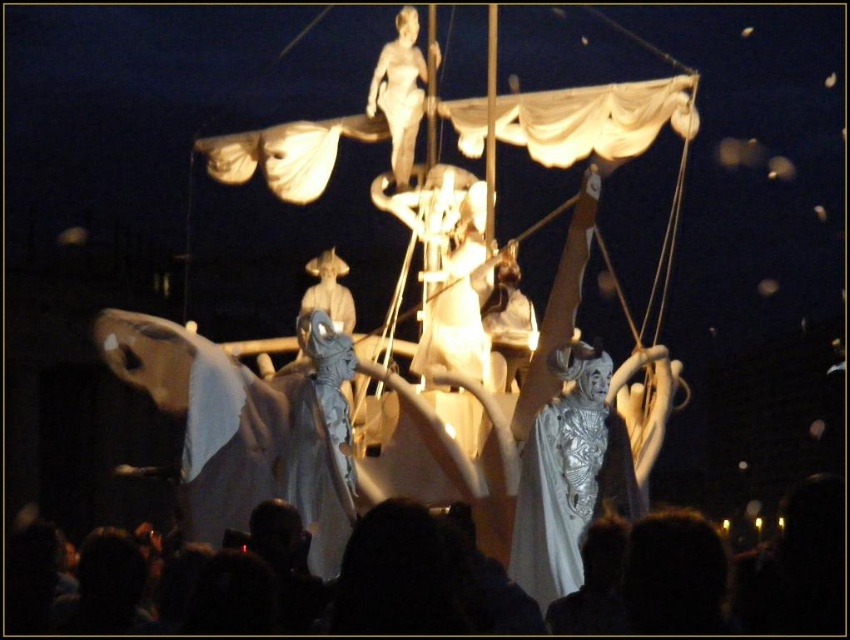
You are an architect analyzing the structure in the image. You need to determine the spatial relationship between the silver textured statue at center and the smooth white statue at upper center. Which one is positioned higher up in the structure?

The smooth white statue at upper center is positioned higher up in the structure than the silver textured statue at center, as the silver textured statue at center is located below it.

You are standing in the nighttime scene with the large ship structure. There is a point marked at coordinates (442, 380). What object is located at that point?

The point at coordinates (442, 380) corresponds to the white fabric boat at center.